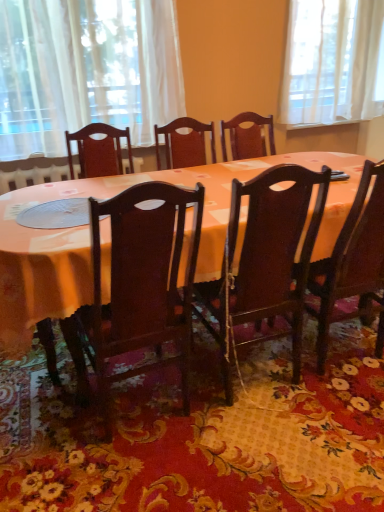
Locate an element on the screen. The height and width of the screenshot is (512, 384). unoccupied area in front of dark wood chair at center, the 3th chair when ordered from right to left is located at coordinates (145, 481).